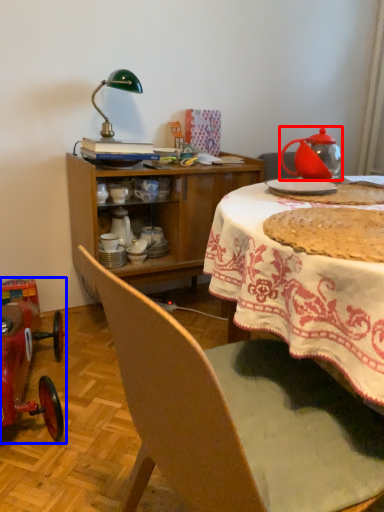
Question: Which of the following is the farthest to the observer, kettle (highlighted by a red box) or model car (highlighted by a blue box)?

Choices:
 (A) kettle
 (B) model car

Answer: (A)